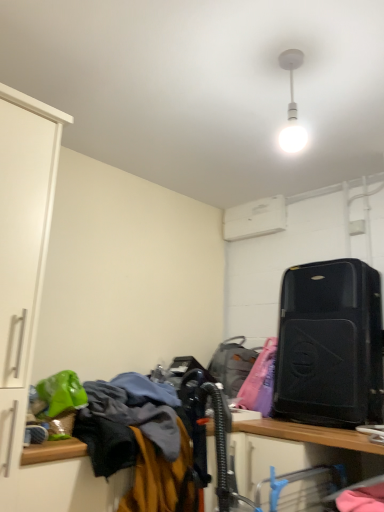
Question: Can you confirm if white matte light bulb at upper center is positioned to the left of metallic silver computer desk at lower center?

Choices:
 (A) no
 (B) yes

Answer: (B)

Question: Does white matte light bulb at upper center have a larger size compared to metallic silver computer desk at lower center?

Choices:
 (A) yes
 (B) no

Answer: (B)

Question: Considering the relative sizes of white matte light bulb at upper center and metallic silver computer desk at lower center in the image provided, is white matte light bulb at upper center taller than metallic silver computer desk at lower center?

Choices:
 (A) no
 (B) yes

Answer: (B)

Question: Does white matte light bulb at upper center have a lesser height compared to metallic silver computer desk at lower center?

Choices:
 (A) yes
 (B) no

Answer: (B)

Question: Can you confirm if white matte light bulb at upper center is thinner than metallic silver computer desk at lower center?

Choices:
 (A) no
 (B) yes

Answer: (B)

Question: Is white matte light bulb at upper center facing towards metallic silver computer desk at lower center?

Choices:
 (A) no
 (B) yes

Answer: (A)

Question: Is wooden desk at lower center outside of matte black suitcase at center right?

Choices:
 (A) no
 (B) yes

Answer: (B)

Question: Considering the relative sizes of wooden desk at lower center and matte black suitcase at center right in the image provided, is wooden desk at lower center taller than matte black suitcase at center right?

Choices:
 (A) yes
 (B) no

Answer: (A)

Question: Does wooden desk at lower center have a larger size compared to matte black suitcase at center right?

Choices:
 (A) no
 (B) yes

Answer: (B)

Question: From the image's perspective, is wooden desk at lower center under matte black suitcase at center right?

Choices:
 (A) no
 (B) yes

Answer: (B)

Question: Is wooden desk at lower center positioned in front of matte black suitcase at center right?

Choices:
 (A) yes
 (B) no

Answer: (A)

Question: Does wooden desk at lower center lie behind matte black suitcase at center right?

Choices:
 (A) no
 (B) yes

Answer: (A)

Question: From the image's perspective, is white plastic air conditioner at upper center beneath black matte suitcase at right?

Choices:
 (A) no
 (B) yes

Answer: (A)